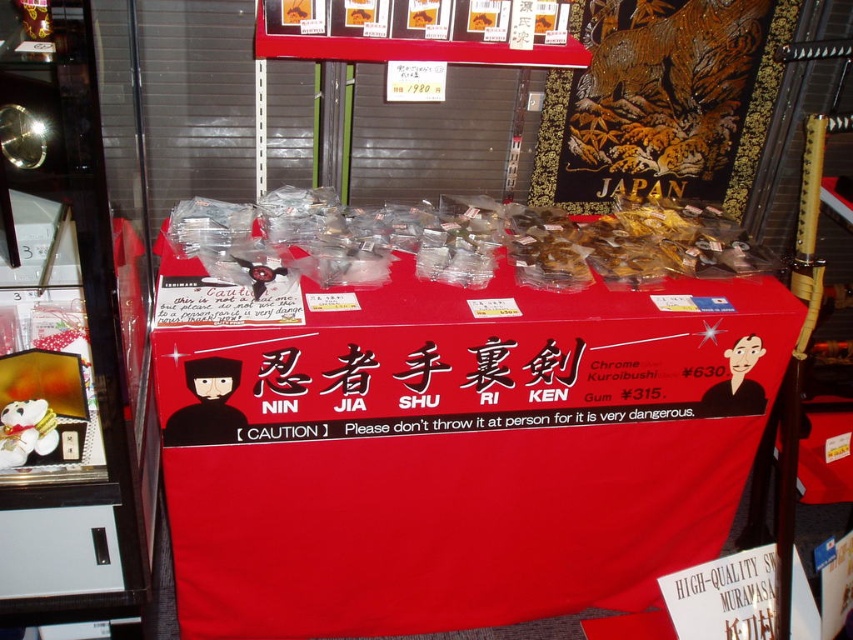
You are a customer at the souvenir shop and want to place a small item between the red fabric tablecloth at center and the black matte ninja mask at center. Can you fit it there?

The distance between the red fabric tablecloth at center and the black matte ninja mask at center is 45.55 centimeters, so yes, you can fit a small item there as the space is sufficient.

You are a customer at the souvenir shop looking at the display stand. You notice two points marked on the stand. Which point is closer to you, point (235, 419) or point (743, 378)?

Point (235, 419) is in front of point (743, 378), so it is closer to you.